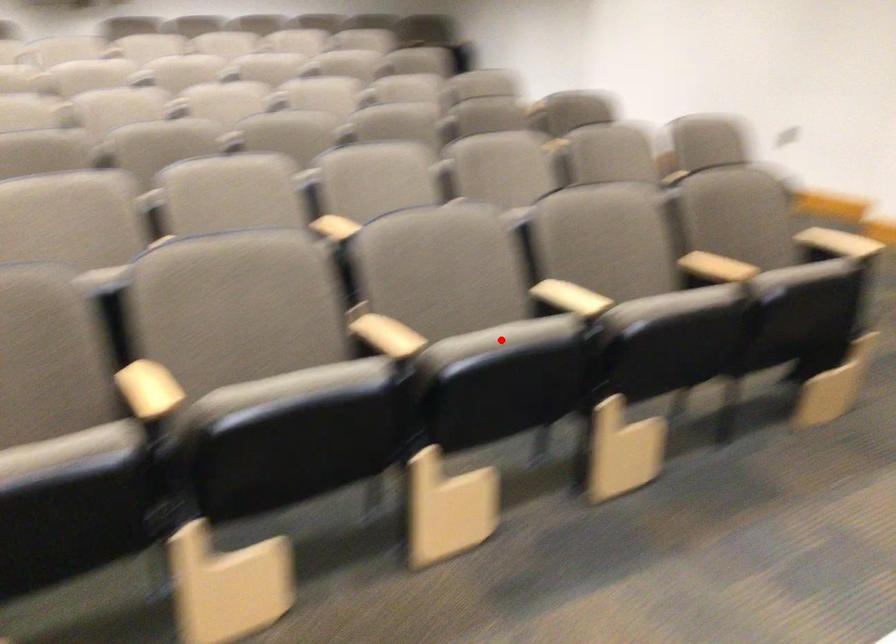
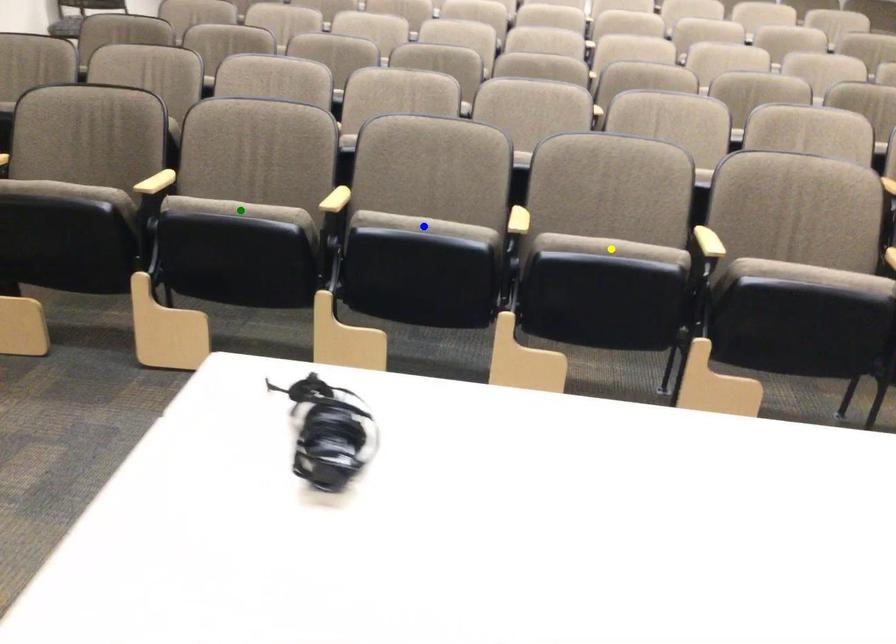
Question: I am providing you with two images of the same scene from different viewpoints. A red point is marked on the first image. You are given multiple points on the second image. Which point in image 2 represents the same 3d spot as the red point in image 1?

Choices:
 (A) yellow point
 (B) green point
 (C) blue point

Answer: (A)